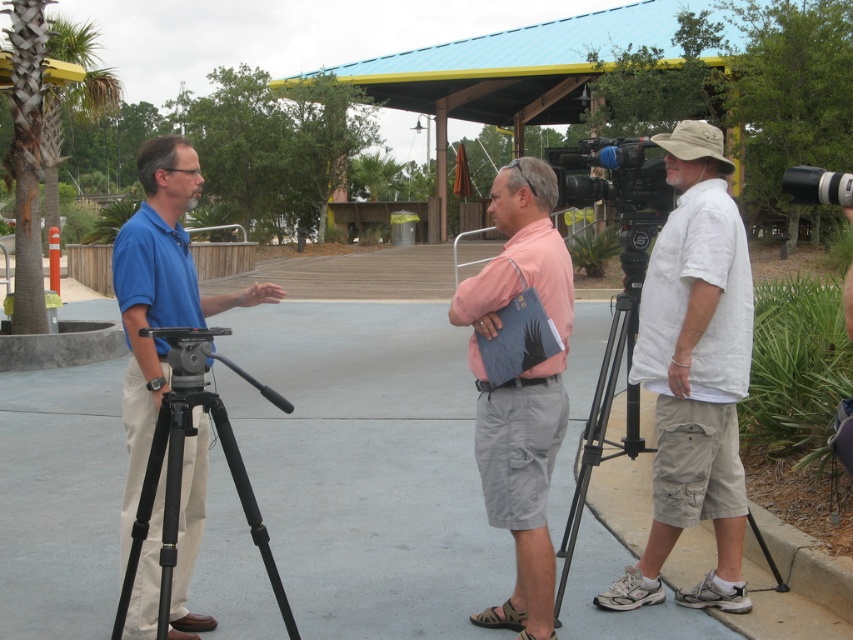
Is pink cotton shirt at center positioned at the back of black plastic video camera at center?

No, pink cotton shirt at center is in front of black plastic video camera at center.

Who is taller, pink cotton shirt at center or black plastic video camera at center?

black plastic video camera at center is taller.

Does point (498, 410) come closer to viewer compared to point (659, 157)?

Yes, it is.

Identify the location of pink cotton shirt at center. The height and width of the screenshot is (640, 853). (520, 388).

Is the position of pink cotton shirt at center less distant than that of black matte tripod at left?

No, it is not.

Does pink cotton shirt at center appear under black matte tripod at left?

Actually, pink cotton shirt at center is above black matte tripod at left.

Where is `pink cotton shirt at center`? pink cotton shirt at center is located at coordinates (520, 388).

Does point (584, 481) come behind point (631, 141)?

No, (584, 481) is closer to viewer.

This screenshot has height=640, width=853. Describe the element at coordinates (606, 406) in the screenshot. I see `black metal tripod at right` at that location.

What do you see at coordinates (606, 406) in the screenshot? This screenshot has width=853, height=640. I see `black metal tripod at right` at bounding box center [606, 406].

The image size is (853, 640). I want to click on black metal tripod at right, so (606, 406).